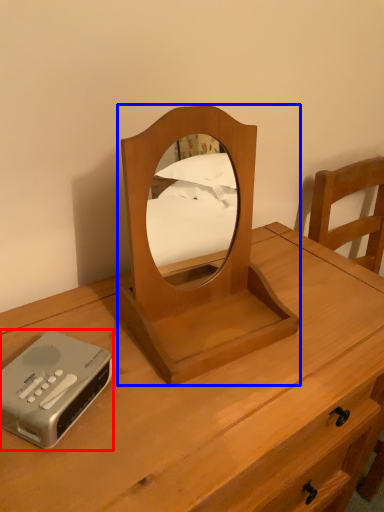
Question: Which of the following is the farthest to the observer, cassette (highlighted by a red box) or mirror (highlighted by a blue box)?

Choices:
 (A) cassette
 (B) mirror

Answer: (A)